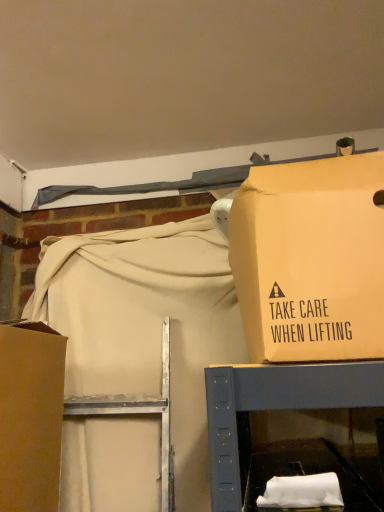
Question: Does matte cardboard box at upper right, which is counted as the 1th box, starting from the right, lie behind brown cardboard box at left, the second box from the right?

Choices:
 (A) no
 (B) yes

Answer: (A)

Question: From the image's perspective, is matte cardboard box at upper right, which is counted as the 1th box, starting from the right, below brown cardboard box at left, which appears as the first box when viewed from the left?

Choices:
 (A) no
 (B) yes

Answer: (A)

Question: Is matte cardboard box at upper right, which is counted as the 1th box, starting from the right, oriented towards brown cardboard box at left, the second box from the right?

Choices:
 (A) no
 (B) yes

Answer: (A)

Question: Is matte cardboard box at upper right, which ranks as the second box in left-to-right order, positioned with its back to brown cardboard box at left, the second box from the right?

Choices:
 (A) no
 (B) yes

Answer: (A)

Question: Does matte cardboard box at upper right, which ranks as the second box in left-to-right order, have a larger size compared to brown cardboard box at left, the second box from the right?

Choices:
 (A) yes
 (B) no

Answer: (A)

Question: Is matte cardboard box at upper right, which ranks as the second box in left-to-right order, thinner than brown cardboard box at left, the second box from the right?

Choices:
 (A) no
 (B) yes

Answer: (A)

Question: Is brown cardboard box at left, the second box from the right, turned away from matte cardboard box at upper right, which is counted as the 1th box, starting from the right?

Choices:
 (A) no
 (B) yes

Answer: (A)

Question: Is brown cardboard box at left, which appears as the first box when viewed from the left, with matte cardboard box at upper right, which ranks as the second box in left-to-right order?

Choices:
 (A) no
 (B) yes

Answer: (A)

Question: Considering the relative sizes of brown cardboard box at left, the second box from the right, and matte cardboard box at upper right, which is counted as the 1th box, starting from the right, in the image provided, is brown cardboard box at left, the second box from the right, wider than matte cardboard box at upper right, which is counted as the 1th box, starting from the right,?

Choices:
 (A) yes
 (B) no

Answer: (B)

Question: Does brown cardboard box at left, the second box from the right, appear on the left side of matte cardboard box at upper right, which is counted as the 1th box, starting from the right?

Choices:
 (A) yes
 (B) no

Answer: (A)

Question: Does brown cardboard box at left, the second box from the right, have a lesser width compared to matte cardboard box at upper right, which ranks as the second box in left-to-right order?

Choices:
 (A) no
 (B) yes

Answer: (B)

Question: From a real-world perspective, is brown cardboard box at left, which appears as the first box when viewed from the left, located beneath matte cardboard box at upper right, which ranks as the second box in left-to-right order?

Choices:
 (A) yes
 (B) no

Answer: (A)

Question: Considering the positions of matte cardboard box at upper right, which ranks as the second box in left-to-right order, and brown cardboard box at left, the second box from the right, in the image, is matte cardboard box at upper right, which ranks as the second box in left-to-right order, bigger or smaller than brown cardboard box at left, the second box from the right,?

Choices:
 (A) small
 (B) big

Answer: (B)